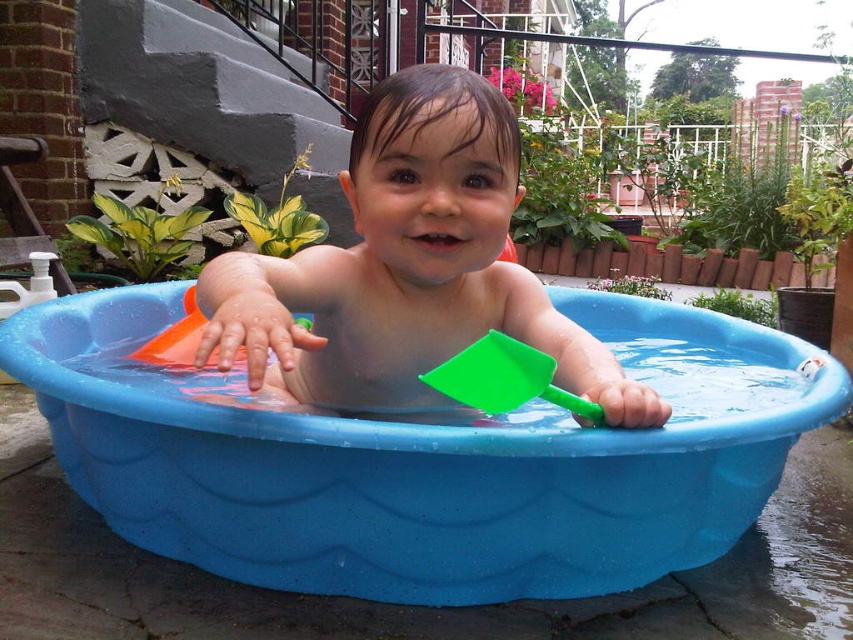
Question: Which object appears farthest from the camera in this image?

Choices:
 (A) blue plastic bath at center
 (B) green plastic shovel at center
 (C) smooth plastic toddler at center

Answer: (A)

Question: Estimate the real-world distances between objects in this image. Which object is closer to the smooth plastic toddler at center?

Choices:
 (A) blue plastic bath at center
 (B) green plastic shovel at center

Answer: (B)

Question: Which of the following is the closest to the observer?

Choices:
 (A) smooth plastic toddler at center
 (B) green plastic shovel at center

Answer: (A)

Question: Can you confirm if blue plastic bath at center is thinner than smooth plastic toddler at center?

Choices:
 (A) no
 (B) yes

Answer: (A)

Question: Does blue plastic bath at center appear on the left side of green plastic shovel at center?

Choices:
 (A) no
 (B) yes

Answer: (B)

Question: Does blue plastic bath at center appear on the right side of green plastic shovel at center?

Choices:
 (A) yes
 (B) no

Answer: (B)